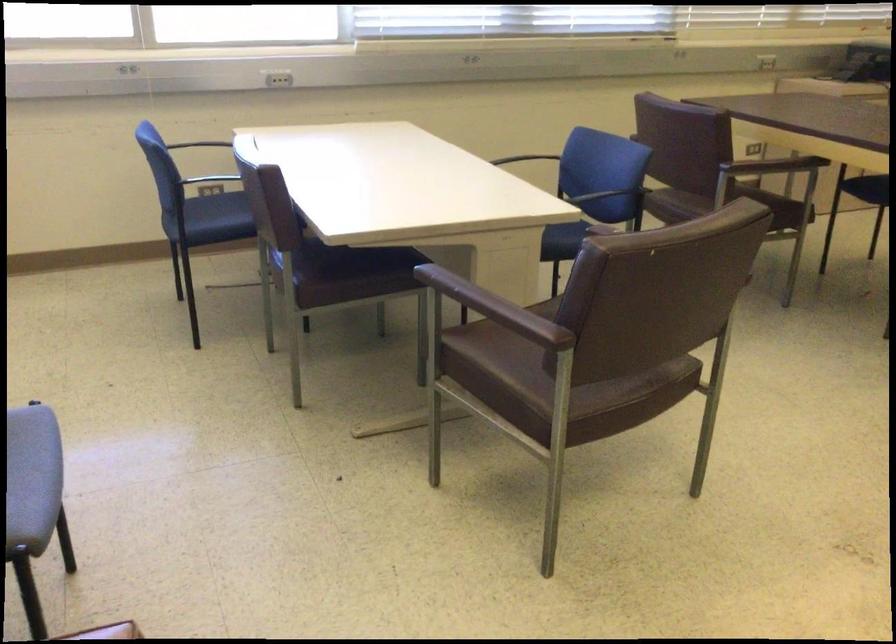
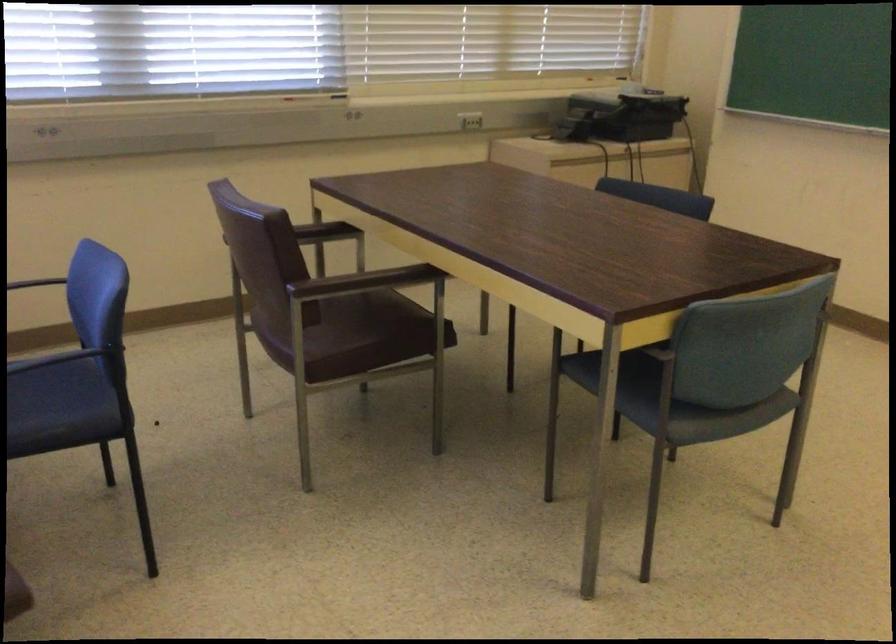
In a continuous first-person perspective shot, in which direction is the camera moving?

The cameraman moved toward right, forward.